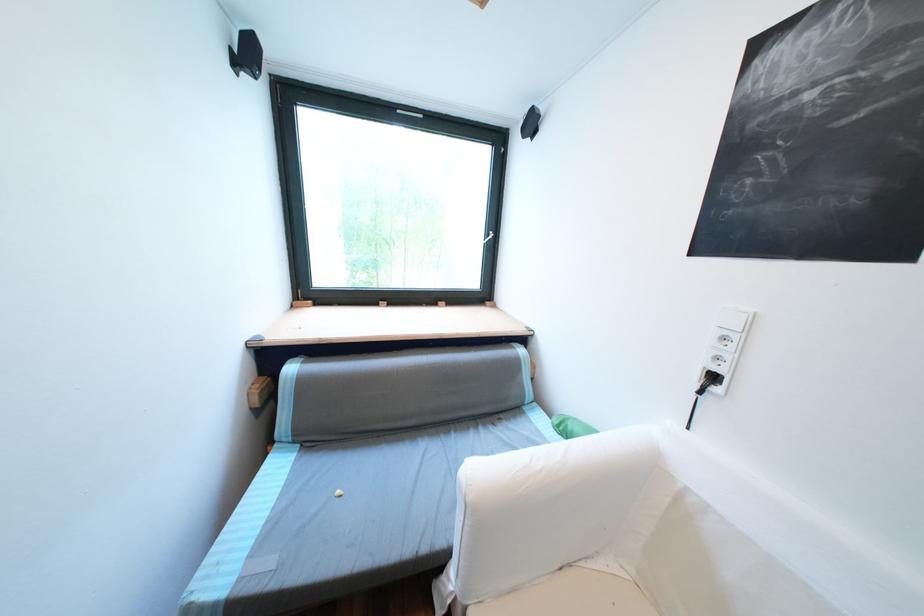
Describe the element at coordinates (488, 237) in the screenshot. This screenshot has width=924, height=616. I see `the white window handle` at that location.